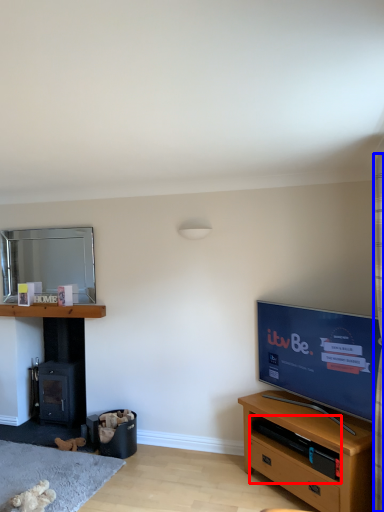
Question: Among these objects, which one is farthest to the camera, shelf (highlighted by a red box) or curtain (highlighted by a blue box)?

Choices:
 (A) shelf
 (B) curtain

Answer: (A)